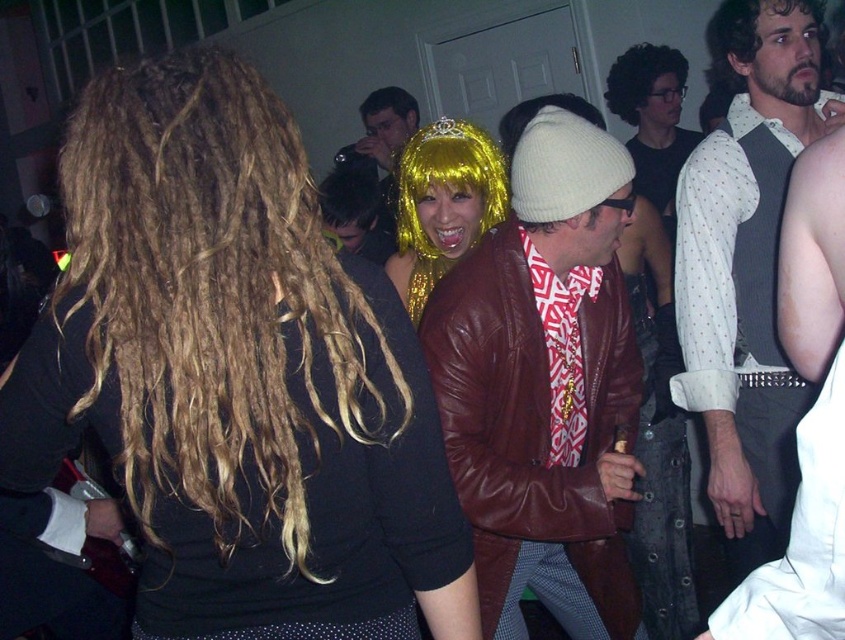
Based on the photo, between golden curly hair at back left and leather jacket at center, which one is positioned lower?

Positioned lower is leather jacket at center.

Is point (112, 218) positioned before point (532, 195)?

Yes, it is.

The width and height of the screenshot is (845, 640). What do you see at coordinates (211, 296) in the screenshot? I see `golden curly hair at back left` at bounding box center [211, 296].

Locate an element on the screen. The height and width of the screenshot is (640, 845). golden curly hair at back left is located at coordinates (211, 296).

Does sparkly gold wig at center appear under golden shiny wig at center?

Yes.

Who is shorter, sparkly gold wig at center or golden shiny wig at center?

Standing shorter between the two is golden shiny wig at center.

Measure the distance between sparkly gold wig at center and camera.

sparkly gold wig at center and camera are 2.05 meters apart from each other.

Where is `sparkly gold wig at center`? The height and width of the screenshot is (640, 845). sparkly gold wig at center is located at coordinates (443, 204).

Which is behind, point (775, 547) or point (612, 81)?

Positioned behind is point (612, 81).

Is point (780, 93) closer to camera compared to point (653, 52)?

Yes, point (780, 93) is closer to viewer.

Is point (731, 230) positioned in front of point (677, 58)?

Yes, it is.

Identify the location of white dotted shirt at upper right. (747, 268).